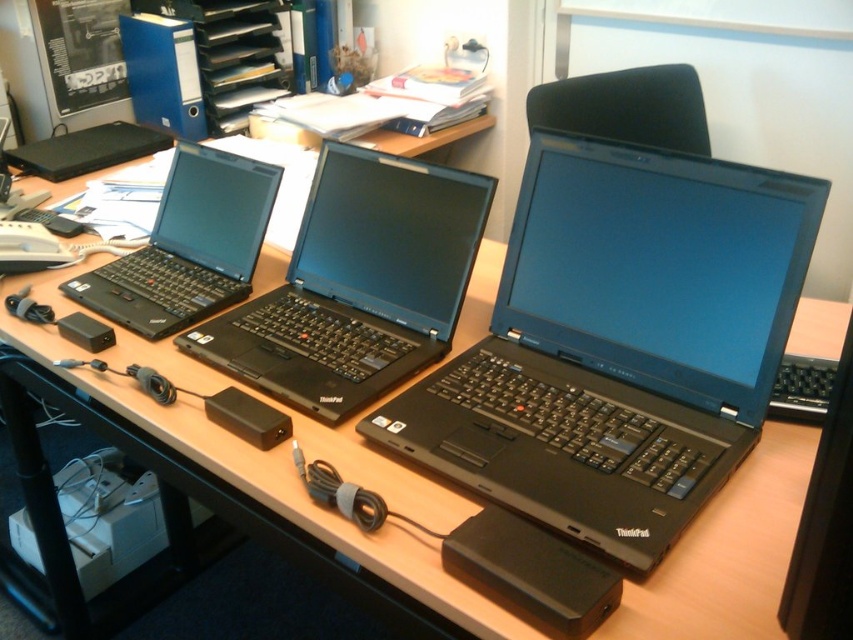
In the scene shown: You are organizing a tech showcase and need to place a new device between the matte black laptop at center and the black matte laptop at left. Given their positions, which laptop should the new device be placed closer to?

The new device should be placed closer to the matte black laptop at center because it is positioned in front of the black matte laptop at left, making it closer to the viewer.

You are standing in front of the workspace with three Lenovo ThinkPad laptops. You notice two points on the desk labeled as point (521, 353) and point (329, 300). Which point is nearer to you?

Point (521, 353) is closer to the camera than point (329, 300), so the point you are closer to is point (521, 353).

You are organizing a tech showcase and need to place a label for the matte black laptop at center. According to the coordinates provided, where should you position the label?

The label for the matte black laptop at center should be placed at the coordinates point (619,342).